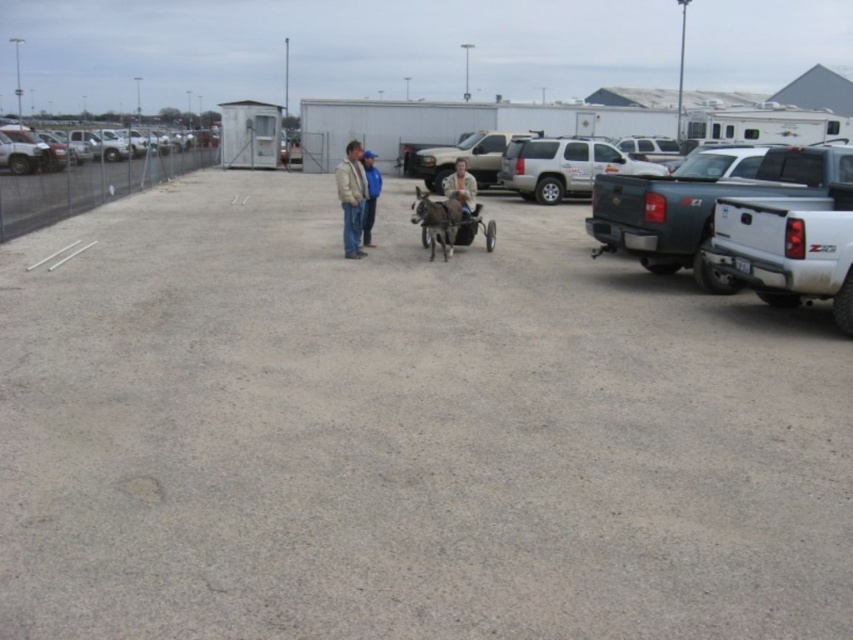
Question: Estimate the real-world distances between objects in this image. Which object is closer to the tan leather jacket at center?

Choices:
 (A) light brown leather jacket at center
 (B) matte black truck at right
 (C) metallic silver cart at center

Answer: (C)

Question: Is matte black truck at right thinner than silver metallic suv at center?

Choices:
 (A) yes
 (B) no

Answer: (A)

Question: Which of the following is the closest to the observer?

Choices:
 (A) blue denim jacket at center
 (B) silver metallic suv at center
 (C) metallic silver cart at center

Answer: (A)

Question: Which of the following is the farthest from the observer?

Choices:
 (A) metallic silver cart at center
 (B) light brown leather jacket at center
 (C) tan leather jacket at center

Answer: (B)

Question: Is silver metallic suv at center smaller than metallic silver cart at center?

Choices:
 (A) yes
 (B) no

Answer: (B)

Question: Does tan leather jacket at center lie behind blue denim jacket at center?

Choices:
 (A) no
 (B) yes

Answer: (A)